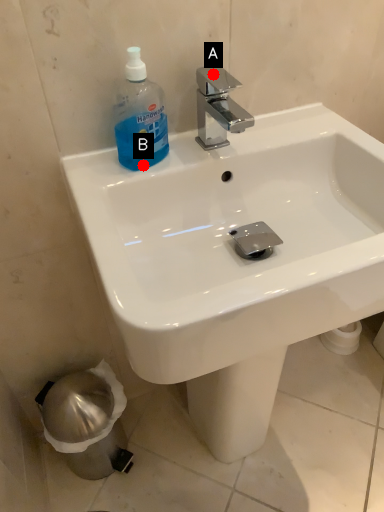
Question: Two points are circled on the image, labeled by A and B beside each circle. Which point is closer to the camera?

Choices:
 (A) A is closer
 (B) B is closer

Answer: (B)